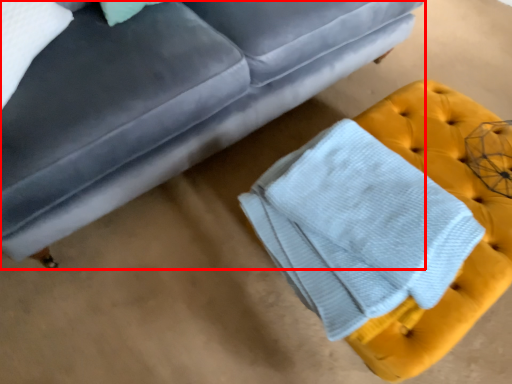
Question: From the image's perspective, what is the correct spatial relationship of studio couch (annotated by the red box) in relation to bath towel?

Choices:
 (A) below
 (B) above

Answer: (B)